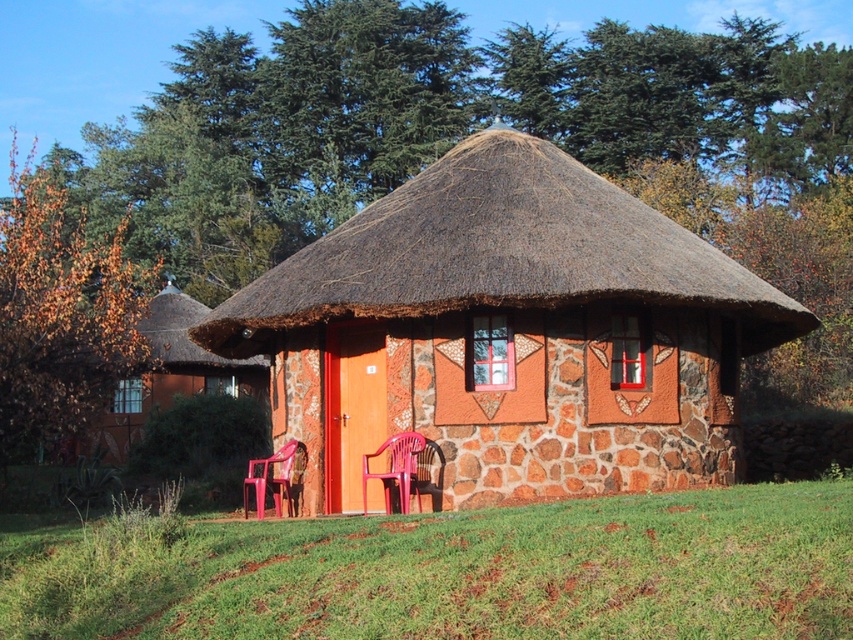
Question: Which object is positioned closest to the brown stone hut at center?

Choices:
 (A) matte plastic chair at center
 (B) brown thatch at center

Answer: (B)

Question: Can you confirm if brown stone hut at center is thinner than matte plastic chair at center?

Choices:
 (A) yes
 (B) no

Answer: (B)

Question: Among these objects, which one is farthest from the camera?

Choices:
 (A) translucent plastic chair at lower center
 (B) matte plastic chair at center
 (C) brown thatch at center

Answer: (A)

Question: Can you confirm if brown stone hut at center is smaller than matte plastic chair at center?

Choices:
 (A) yes
 (B) no

Answer: (B)

Question: Which point is closer to the camera?

Choices:
 (A) brown thatch at center
 (B) translucent plastic chair at lower center

Answer: (A)

Question: Does brown thatch at center appear on the right side of translucent plastic chair at lower center?

Choices:
 (A) no
 (B) yes

Answer: (B)